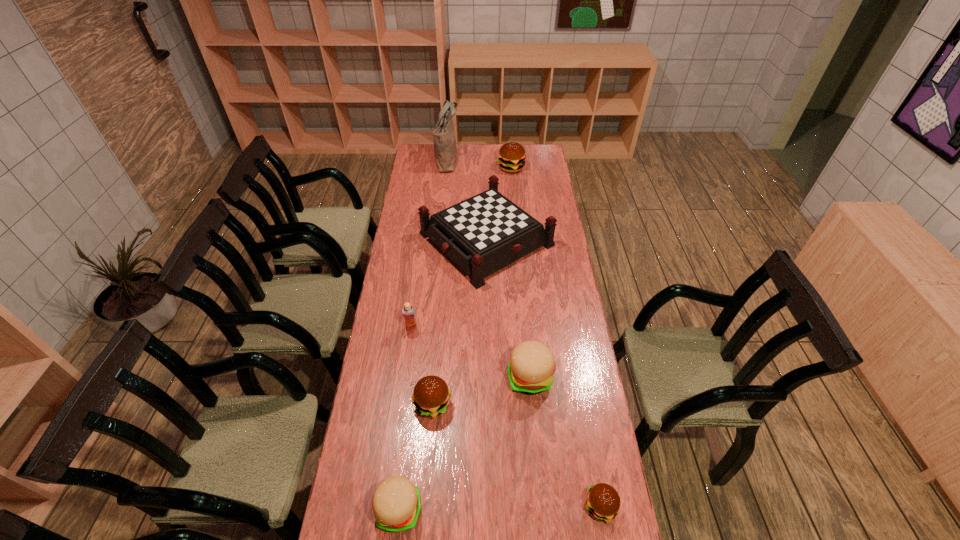
This screenshot has width=960, height=540. I want to click on the tallest object, so click(445, 151).

Locate an element on the screen. This screenshot has height=540, width=960. tan shoulder bag is located at coordinates (445, 151).

What are the coordinates of `red checkerboard` in the screenshot? It's located at (483, 234).

Identify the location of checkerboard. (483, 234).

Find the location of a particular element. The width and height of the screenshot is (960, 540). the second brown hamburger from left to right is located at coordinates (511, 157).

Identify the location of the biggest brown hamburger. (511, 157).

You are a GUI agent. You are given a task and a screenshot of the screen. Output one action in this format:
    pyautogui.click(x=<x>, y=<y>)
    Task: Click on the right beige hamburger
    The width and height of the screenshot is (960, 540).
    Given the screenshot: What is the action you would take?
    pyautogui.click(x=531, y=367)

You are a GUI agent. You are given a task and a screenshot of the screen. Output one action in this format:
    pyautogui.click(x=<x>, y=<y>)
    Task: Click on the bigger beige hamburger
    The height and width of the screenshot is (540, 960).
    Given the screenshot: What is the action you would take?
    pyautogui.click(x=531, y=367)

This screenshot has height=540, width=960. Find the location of `orange juice`. orange juice is located at coordinates (408, 311).

Locate an element on the screen. This screenshot has width=960, height=540. the leftmost brown hamburger is located at coordinates (431, 396).